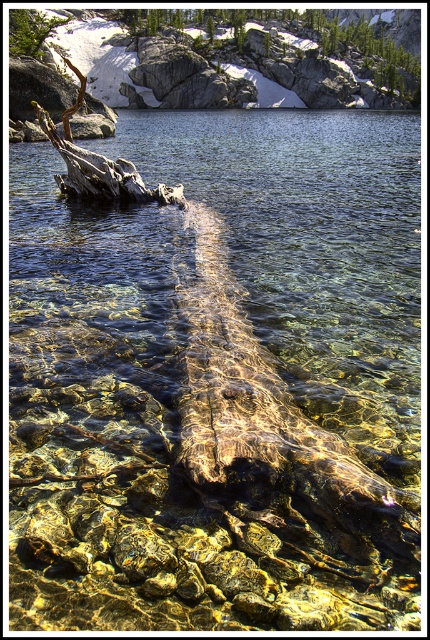
Question: Can you confirm if smooth gray rock at upper center is positioned above green leafy tree at upper left?

Choices:
 (A) no
 (B) yes

Answer: (B)

Question: Which point is closer to the camera?

Choices:
 (A) smooth gray rock at upper center
 (B) green leafy tree at upper left

Answer: (B)

Question: Is smooth gray rock at upper center to the left of green leafy tree at upper left from the viewer's perspective?

Choices:
 (A) yes
 (B) no

Answer: (B)

Question: Is smooth gray rock at upper center to the right of green leafy tree at upper left from the viewer's perspective?

Choices:
 (A) yes
 (B) no

Answer: (A)

Question: Among these points, which one is farthest from the camera?

Choices:
 (A) (218, 44)
 (B) (60, 22)

Answer: (A)